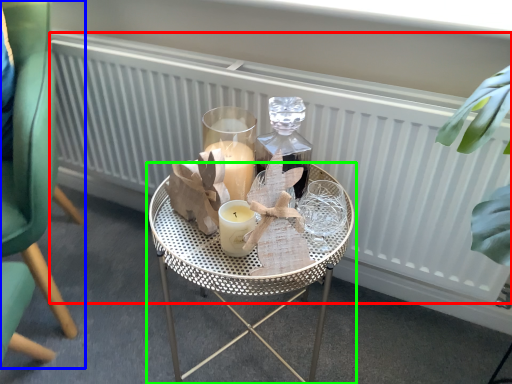
Question: Which is farther away from radiator (highlighted by a red box)? chair (highlighted by a blue box) or table (highlighted by a green box)?

Choices:
 (A) chair
 (B) table

Answer: (A)